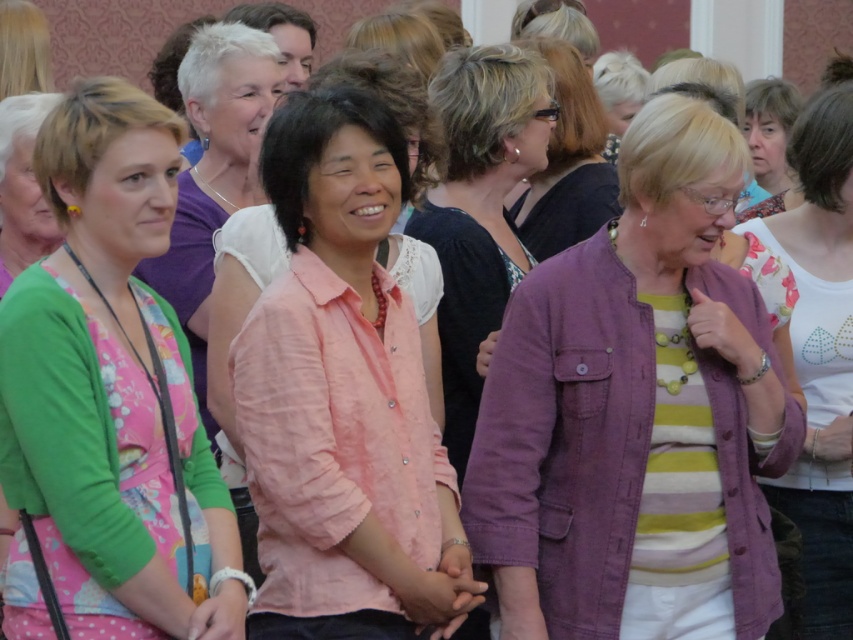
In the scene described, there are two women wearing specific clothing items. The first is wearing a striped knit sweater at center, and the second has a printed fabric blouse at upper right. From the perspective of someone standing in front of them, which clothing item is positioned to the left?

The striped knit sweater at center is to the left of the printed fabric blouse at upper right.